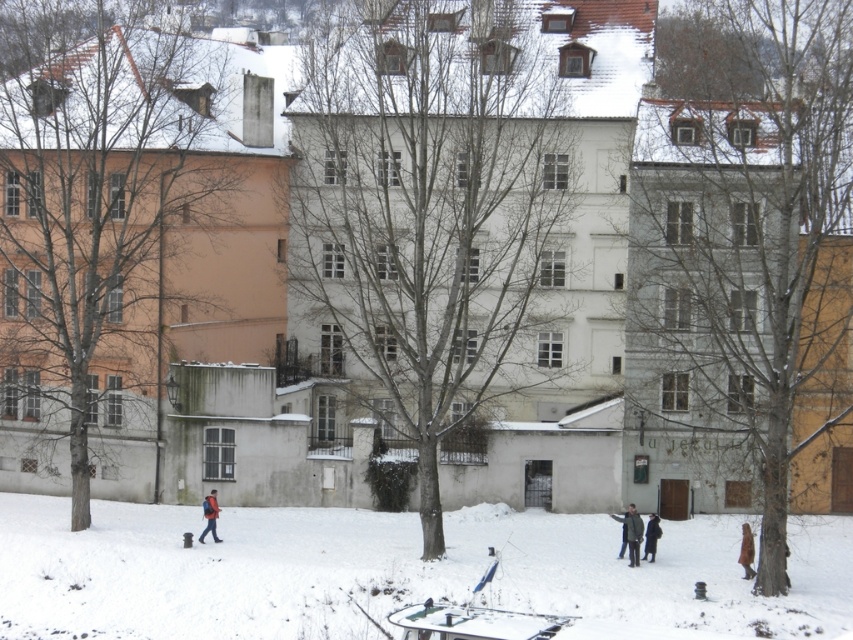
You are standing in the snowy urban scene and notice two coats hanging on a post. Which coat is closer to the ground, the brown wool coat at lower right or the dark wool coat at center?

The brown wool coat at lower right is closer to the ground because it is located below the dark wool coat at center.

You are standing in the snowy urban scene described. You need to locate the brown wool coat at lower right. Based on the coordinates provided, where exactly would you find it?

The brown wool coat at lower right is located at the 2D coordinates point (x=746, y=552).